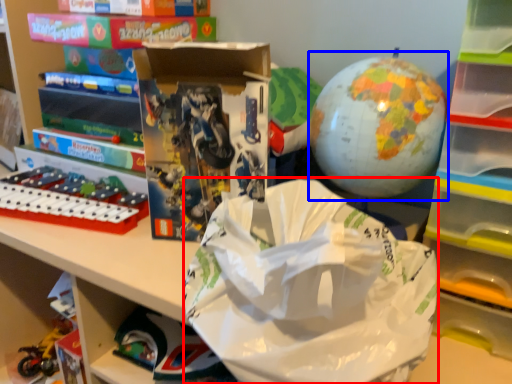
Question: Among these objects, which one is farthest to the camera, grocery bag (highlighted by a red box) or toy (highlighted by a blue box)?

Choices:
 (A) grocery bag
 (B) toy

Answer: (B)